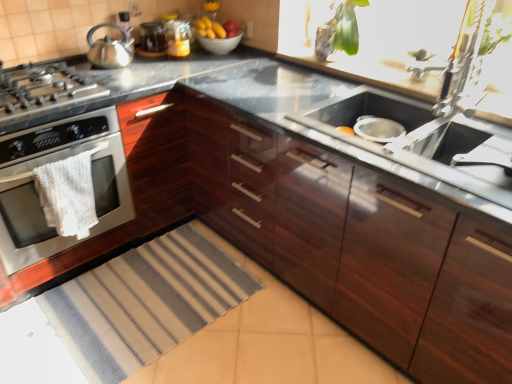
Question: Does matte glass jar at upper center have a lesser height compared to satin silver gas stove at left?

Choices:
 (A) yes
 (B) no

Answer: (B)

Question: Is matte glass jar at upper center smaller than satin silver gas stove at left?

Choices:
 (A) yes
 (B) no

Answer: (A)

Question: Does matte glass jar at upper center have a greater height compared to satin silver gas stove at left?

Choices:
 (A) no
 (B) yes

Answer: (B)

Question: Is matte glass jar at upper center bigger than satin silver gas stove at left?

Choices:
 (A) no
 (B) yes

Answer: (A)

Question: Does matte glass jar at upper center have a lesser width compared to satin silver gas stove at left?

Choices:
 (A) yes
 (B) no

Answer: (A)

Question: Is matte glass jar at upper center to the left of satin silver gas stove at left from the viewer's perspective?

Choices:
 (A) no
 (B) yes

Answer: (A)

Question: From a real-world perspective, is satin silver oven at left located higher than glossy wood cabinets at center?

Choices:
 (A) no
 (B) yes

Answer: (A)

Question: Would you say satin silver oven at left is outside glossy wood cabinets at center?

Choices:
 (A) no
 (B) yes

Answer: (B)

Question: Is satin silver oven at left further to the viewer compared to glossy wood cabinets at center?

Choices:
 (A) yes
 (B) no

Answer: (A)

Question: Is satin silver oven at left positioned far away from glossy wood cabinets at center?

Choices:
 (A) yes
 (B) no

Answer: (B)

Question: Is satin silver oven at left facing away from glossy wood cabinets at center?

Choices:
 (A) yes
 (B) no

Answer: (B)

Question: From the image's perspective, is satin silver oven at left over glossy wood cabinets at center?

Choices:
 (A) no
 (B) yes

Answer: (B)

Question: Considering the relative sizes of glossy wood cabinets at center and metallic silver faucet at upper right in the image provided, is glossy wood cabinets at center thinner than metallic silver faucet at upper right?

Choices:
 (A) no
 (B) yes

Answer: (A)